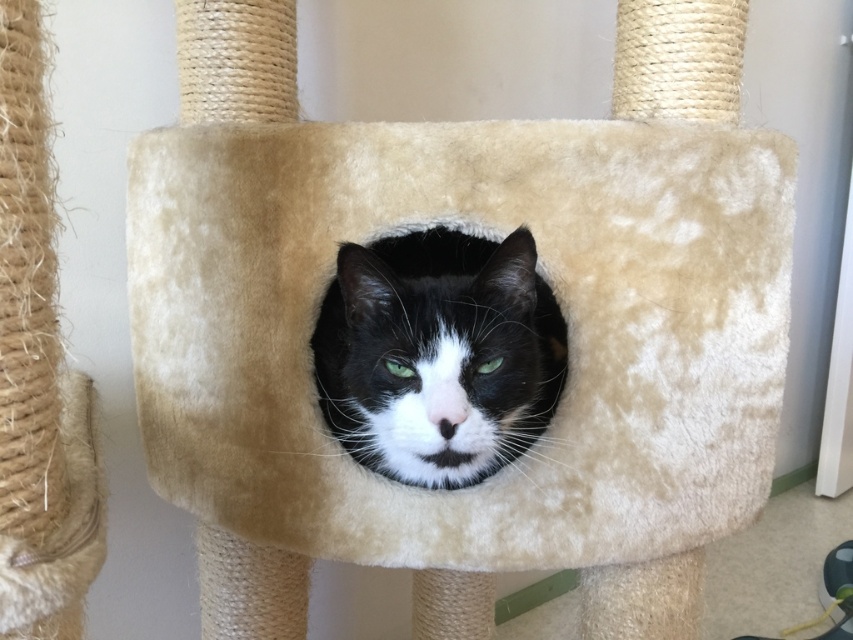
Question: Which point is closer to the camera taking this photo?

Choices:
 (A) (415, 246)
 (B) (207, 470)

Answer: (B)

Question: Does beige plush cat bed at center appear on the left side of black fur cat at center?

Choices:
 (A) yes
 (B) no

Answer: (B)

Question: Which of the following is the farthest from the observer?

Choices:
 (A) black fur cat at center
 (B) beige plush cat bed at center

Answer: (B)

Question: Is beige plush cat bed at center above black fur cat at center?

Choices:
 (A) yes
 (B) no

Answer: (B)

Question: Does beige plush cat bed at center have a lesser width compared to black fur cat at center?

Choices:
 (A) no
 (B) yes

Answer: (A)

Question: Which point appears closest to the camera in this image?

Choices:
 (A) (383, 310)
 (B) (596, 364)

Answer: (A)